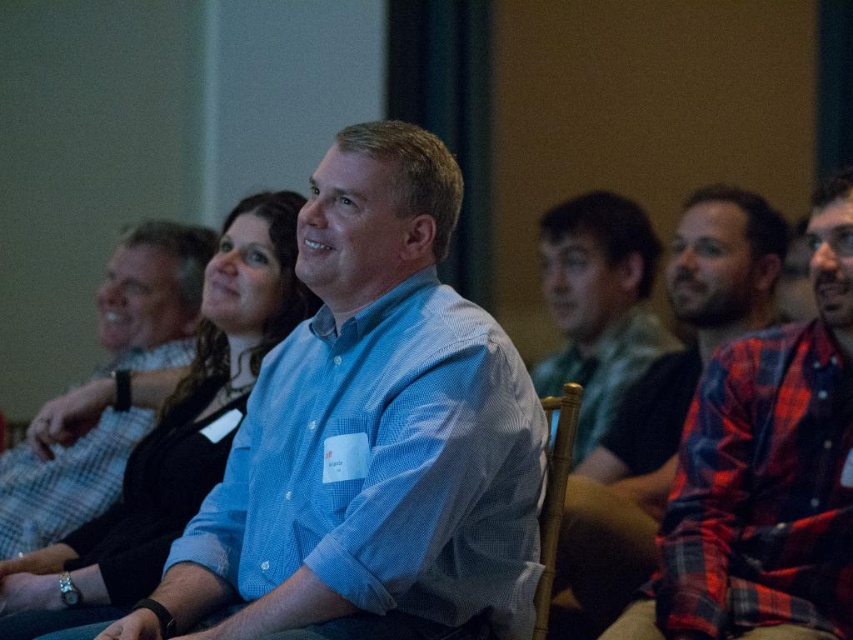
Question: Which object appears closest to the camera in this image?

Choices:
 (A) blue shirt at center
 (B) wooden at center
 (C) red plaid shirt at right

Answer: (B)

Question: Which of the following is the farthest from the observer?

Choices:
 (A) (561, 442)
 (B) (103, 332)
 (C) (337, 364)

Answer: (B)

Question: Which is nearer to the blue checkered shirt at center?

Choices:
 (A) wooden at center
 (B) red plaid shirt at right
 (C) blue shirt at center
 (D) green fabric shirt at center

Answer: (A)

Question: In this image, where is blue checkered shirt at center located relative to blue shirt at center?

Choices:
 (A) right
 (B) left

Answer: (A)

Question: Does blue shirt at center appear over green fabric shirt at center?

Choices:
 (A) yes
 (B) no

Answer: (B)

Question: Is red plaid shirt at right above blue shirt at center?

Choices:
 (A) no
 (B) yes

Answer: (A)